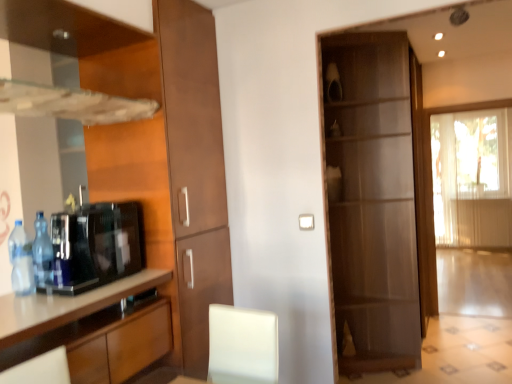
Question: Is blue plastic bottle at left, the second bottle when ordered from front to back, located within matte brown cabinet at center?

Choices:
 (A) yes
 (B) no

Answer: (B)

Question: Is matte brown cabinet at center not close to blue plastic bottle at left, the second bottle when ordered from front to back?

Choices:
 (A) no
 (B) yes

Answer: (B)

Question: Is matte brown cabinet at center further to camera compared to blue plastic bottle at left, which is counted as the first bottle, starting from the back?

Choices:
 (A) yes
 (B) no

Answer: (A)

Question: Does matte brown cabinet at center touch blue plastic bottle at left, which is counted as the first bottle, starting from the back?

Choices:
 (A) yes
 (B) no

Answer: (B)

Question: Considering the relative sizes of matte brown cabinet at center and blue plastic bottle at left, the second bottle when ordered from front to back, in the image provided, is matte brown cabinet at center thinner than blue plastic bottle at left, the second bottle when ordered from front to back,?

Choices:
 (A) no
 (B) yes

Answer: (A)

Question: Considering the relative positions of matte brown cabinet at center and blue plastic bottle at left, which is counted as the first bottle, starting from the back, in the image provided, is matte brown cabinet at center to the right of blue plastic bottle at left, which is counted as the first bottle, starting from the back, from the viewer's perspective?

Choices:
 (A) yes
 (B) no

Answer: (A)

Question: Is black glossy coffee machine at lower left thinner than translucent fabric curtain at right?

Choices:
 (A) yes
 (B) no

Answer: (B)

Question: Is the depth of black glossy coffee machine at lower left less than that of translucent fabric curtain at right?

Choices:
 (A) yes
 (B) no

Answer: (A)

Question: Is black glossy coffee machine at lower left positioned behind translucent fabric curtain at right?

Choices:
 (A) yes
 (B) no

Answer: (B)

Question: Would you say black glossy coffee machine at lower left is outside translucent fabric curtain at right?

Choices:
 (A) yes
 (B) no

Answer: (A)

Question: Considering the relative sizes of black glossy coffee machine at lower left and translucent fabric curtain at right in the image provided, is black glossy coffee machine at lower left taller than translucent fabric curtain at right?

Choices:
 (A) yes
 (B) no

Answer: (B)

Question: Considering the relative positions of black glossy coffee machine at lower left and translucent fabric curtain at right in the image provided, is black glossy coffee machine at lower left to the left of translucent fabric curtain at right from the viewer's perspective?

Choices:
 (A) yes
 (B) no

Answer: (A)

Question: Is blue plastic bottle at left, which is the first bottle in front-to-back order, facing towards black glossy coffee machine at lower left?

Choices:
 (A) yes
 (B) no

Answer: (A)